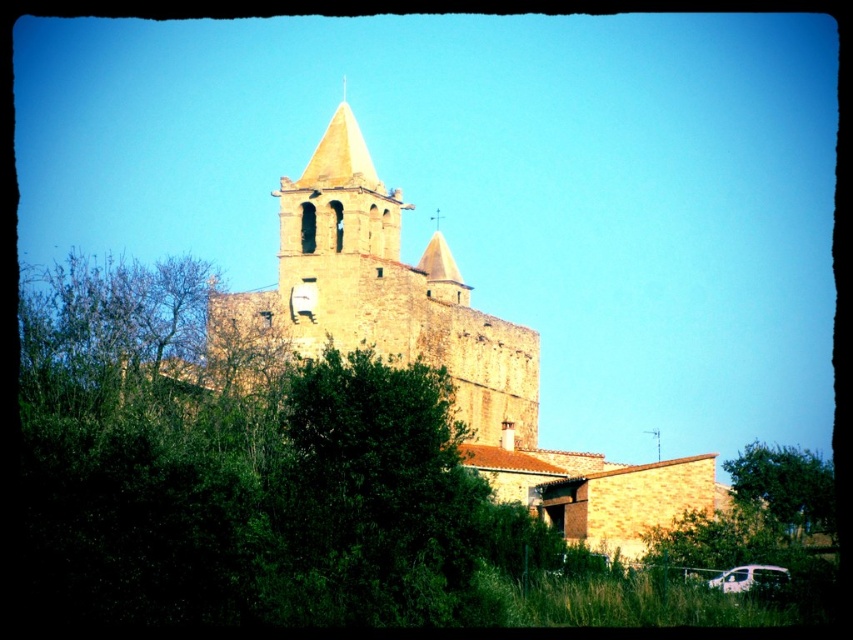
You are a photographer planning to take a photo of the brown stone church at center and the white matte van at lower right. Based on their sizes in the image, which one would appear larger in your photo?

The brown stone church at center is taller than the white matte van at lower right, so it would appear larger in the photo.

You are a delivery driver needing to park your white matte van at lower right near the historic stone building. However, there is a green leafy tree at lower right in the way. Based on their widths, can your van fit through the space next to the tree?

The green leafy tree at lower right might be wider than white matte van at lower right, so there is a possibility that the van cannot fit through the space next to the tree due to the tree possibly being wider.

You are standing in front of the historic stone building and want to take a photo that includes both the bell tower and the dense foliage. You notice two points marked on your map at coordinates point (364, 227) and point (759, 579). Which point is closer to you, the photographer?

Point (364, 227) is closer to you because it is further to the camera than point (759, 579).